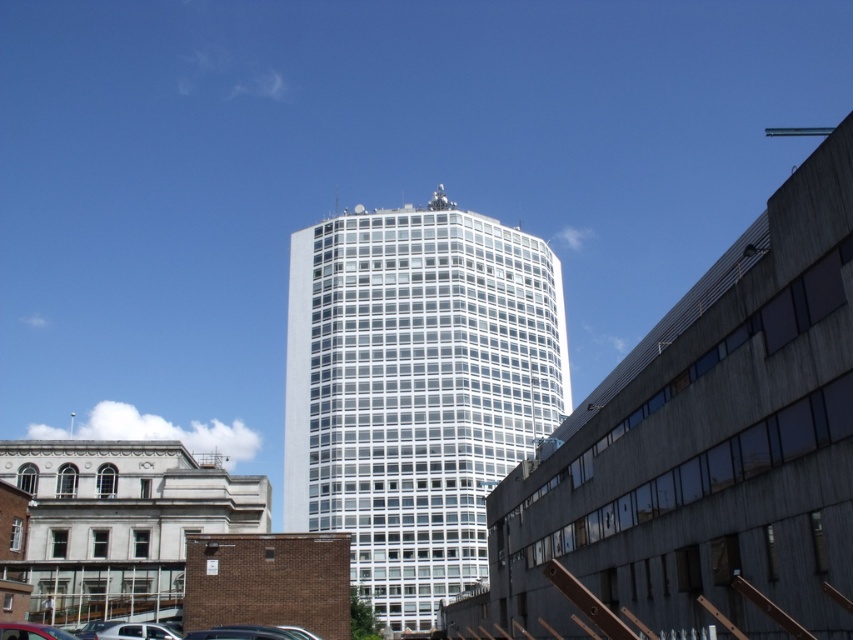
Can you confirm if white glass tower at center is shorter than white glossy car at lower left?

Incorrect, white glass tower at center's height does not fall short of white glossy car at lower left's.

You are a GUI agent. You are given a task and a screenshot of the screen. Output one action in this format:
    pyautogui.click(x=<x>, y=<y>)
    Task: Click on the white glass tower at center
    The image size is (853, 640).
    Given the screenshot: What is the action you would take?
    pyautogui.click(x=415, y=388)

Image resolution: width=853 pixels, height=640 pixels. I want to click on white glass tower at center, so click(415, 388).

Between white glossy car at lower left and matte red car at lower left, which one has less height?

white glossy car at lower left

At what (x,y) coordinates should I click in order to perform the action: click on white glossy car at lower left. Please return your answer as a coordinate pair (x, y). This screenshot has height=640, width=853. Looking at the image, I should click on (136, 632).

In the scene shown: Is white glass tower at center to the right of matte red car at lower left from the viewer's perspective?

Yes, white glass tower at center is to the right of matte red car at lower left.

Who is more forward, (418, 616) or (22, 627)?

Point (22, 627) is in front.

Where is `white glass tower at center`? white glass tower at center is located at coordinates (415, 388).